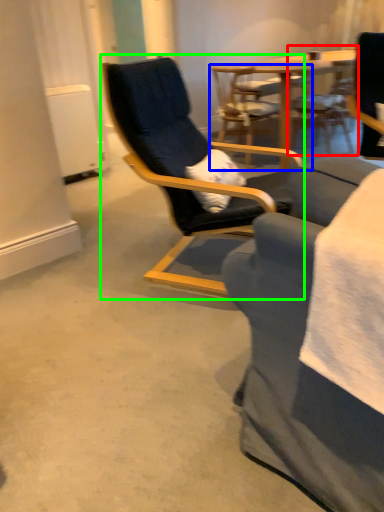
Question: Based on their relative distances, which object is nearer to chair (highlighted by a red box)? Choose from chair (highlighted by a blue box) and chair (highlighted by a green box).

Choices:
 (A) chair
 (B) chair

Answer: (A)